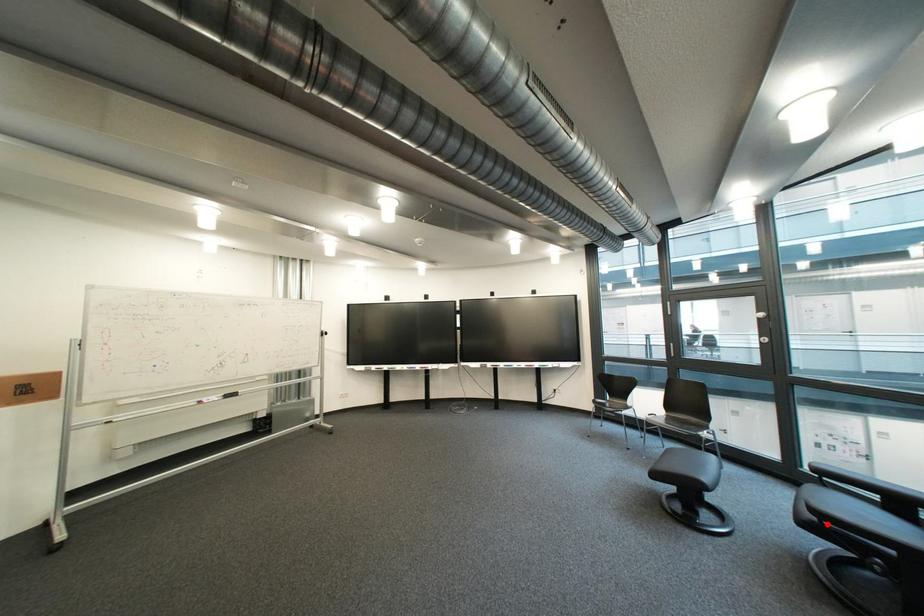
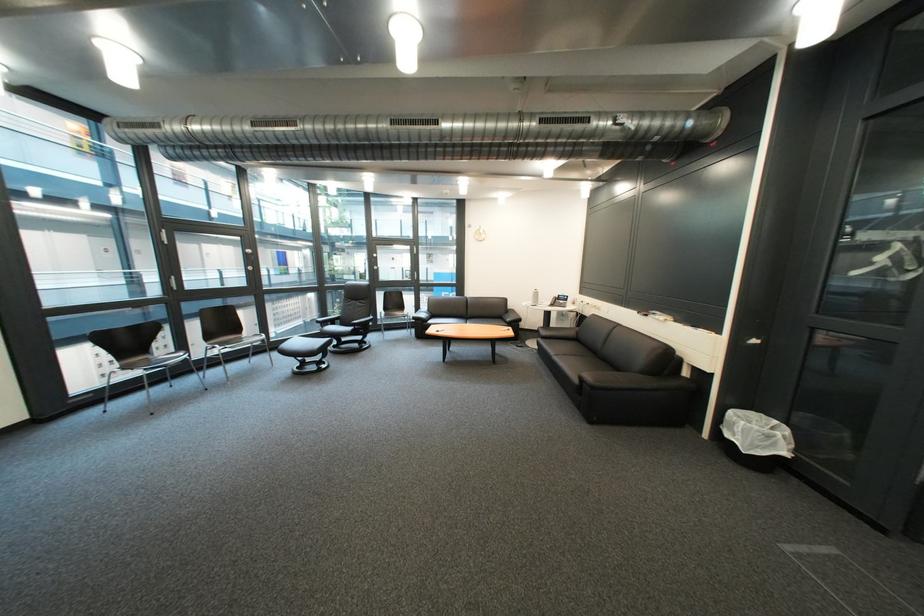
Question: A red point is marked in image1. In image2, is the corresponding 3D point closer to the camera or farther? Reply with the corresponding letter.

Choices:
 (A) The corresponding 3D point is closer.
 (B) The corresponding 3D point is farther.

Answer: (A)